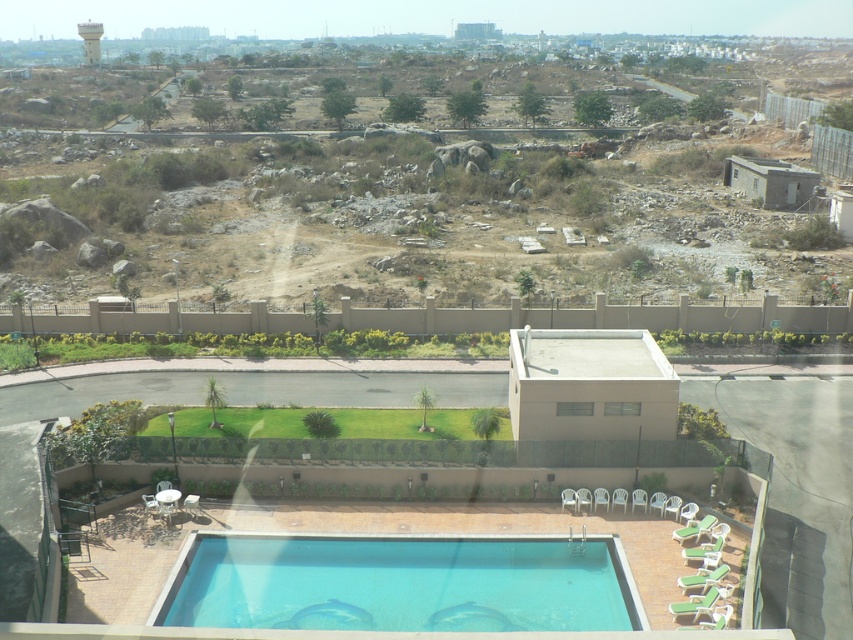
Which is behind, point (585, 273) or point (640, 620)?

The point (585, 273) is behind.

The height and width of the screenshot is (640, 853). What do you see at coordinates (415, 177) in the screenshot?
I see `brown rocky terrain at upper center` at bounding box center [415, 177].

Who is more forward, (268,90) or (380,573)?

Point (380,573)

Where is `brown rocky terrain at upper center`? This screenshot has height=640, width=853. brown rocky terrain at upper center is located at coordinates (415, 177).

Is brown rocky terrain at upper center thinner than white concrete water tower at upper left?

In fact, brown rocky terrain at upper center might be wider than white concrete water tower at upper left.

Is brown rocky terrain at upper center to the left of white concrete water tower at upper left from the viewer's perspective?

No, brown rocky terrain at upper center is not to the left of white concrete water tower at upper left.

Is point (558, 125) more distant than point (91, 48)?

That is False.

Locate an element on the screen. The height and width of the screenshot is (640, 853). brown rocky terrain at upper center is located at coordinates (415, 177).

Between clear glass pool at lower center and white concrete water tower at upper left, which one has less height?

clear glass pool at lower center is shorter.

Does point (496, 573) come closer to viewer compared to point (94, 52)?

Yes, it is.

What do you see at coordinates (401, 582) in the screenshot?
I see `clear glass pool at lower center` at bounding box center [401, 582].

At what (x,y) coordinates should I click in order to perform the action: click on clear glass pool at lower center. Please return your answer as a coordinate pair (x, y). Image resolution: width=853 pixels, height=640 pixels. Looking at the image, I should click on coord(401,582).